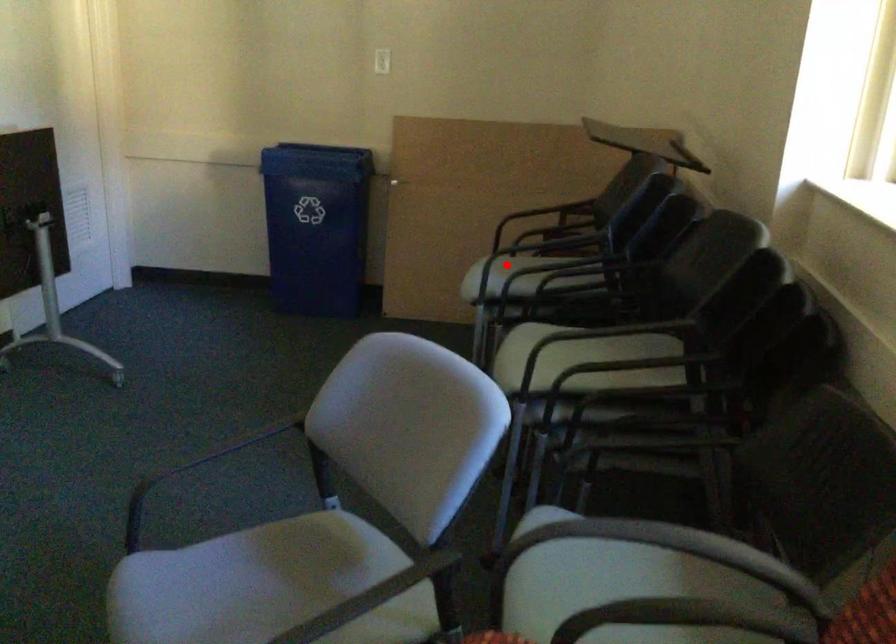
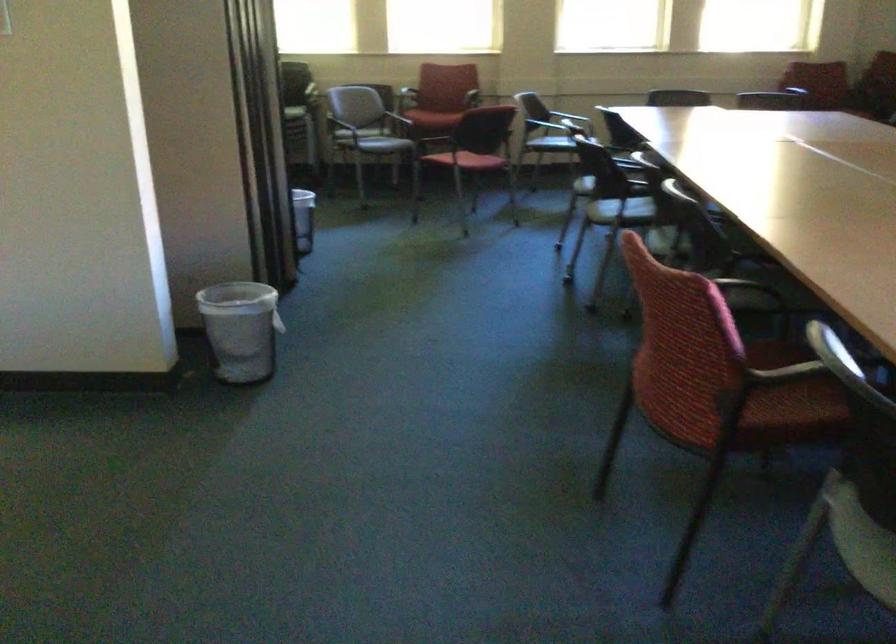
Question: I am providing you with two images of the same scene from different viewpoints. A red point is marked on the first image. Can you still see the location of the red point in image 2?

Choices:
 (A) Yes
 (B) No

Answer: (B)